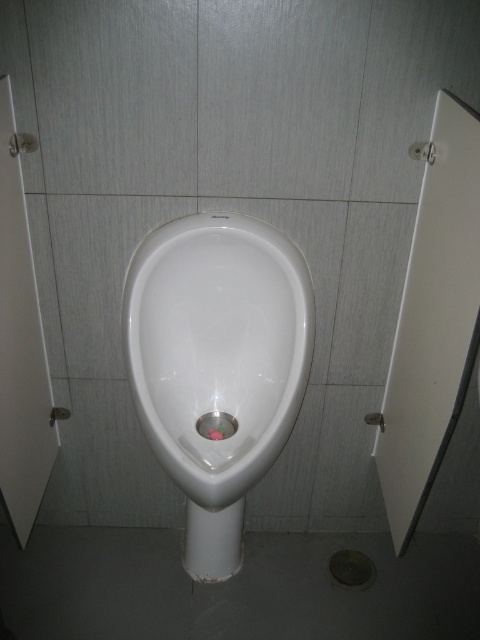
Question: Is matte metallic drain at lower center further to camera compared to metallic silver drain at center?

Choices:
 (A) yes
 (B) no

Answer: (A)

Question: Can you confirm if white glossy urinal at center is positioned above matte metallic drain at lower center?

Choices:
 (A) yes
 (B) no

Answer: (A)

Question: Estimate the real-world distances between objects in this image. Which object is closer to the metallic silver drain at center?

Choices:
 (A) white glossy urinal at center
 (B) matte metallic drain at lower center

Answer: (A)

Question: Which point is farther to the camera?

Choices:
 (A) metallic silver drain at center
 (B) matte metallic drain at lower center

Answer: (B)

Question: Which point is farther to the camera?

Choices:
 (A) white glossy urinal at center
 (B) metallic silver drain at center

Answer: (B)

Question: Can you confirm if matte metallic drain at lower center is positioned below metallic silver drain at center?

Choices:
 (A) no
 (B) yes

Answer: (B)